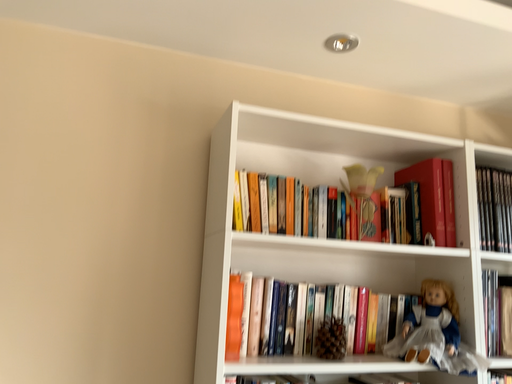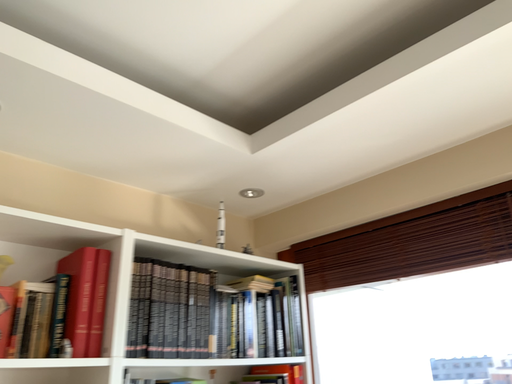
Question: Which way did the camera rotate in the video?

Choices:
 (A) rotated upward
 (B) rotated downward

Answer: (A)